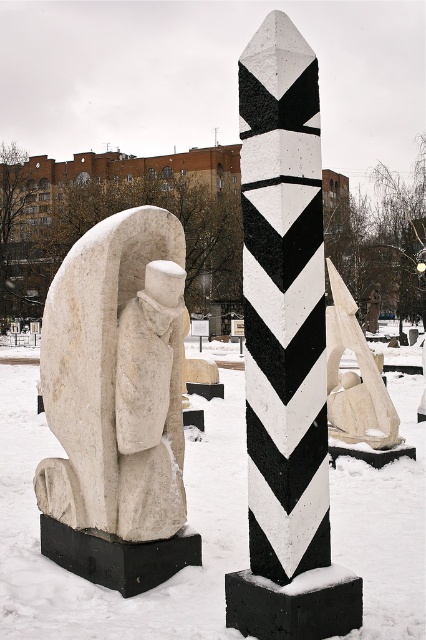
You are a photographer setting up a tripod to capture both the black and white painted concrete pillar at center and the white stone statue at left in the same frame. Based on their heights, which object will appear taller in your photo?

The black and white painted concrete pillar at center will appear taller in the photo since it has a greater height compared to the white stone statue at left according to the description.

You are a photographer planning to take a photo of both the black and white painted concrete pillar at center and the white stone sculpture at center. Since you want both to be in focus, you need to know their distance relationship. Which one is closer to you?

The black and white painted concrete pillar at center is closer to the viewer than the white stone sculpture at center, so to have both in focus, you should adjust your camera settings for the distance between them.

You are standing in the winter scene and want to take a photo of both the white stone statue at left and the white stone sculpture at center. Which one should you adjust your camera focus to first to ensure both are in the frame?

The white stone statue at left is in front of the white stone sculpture at center, so you should focus on the white stone statue at left first to ensure both are in focus.